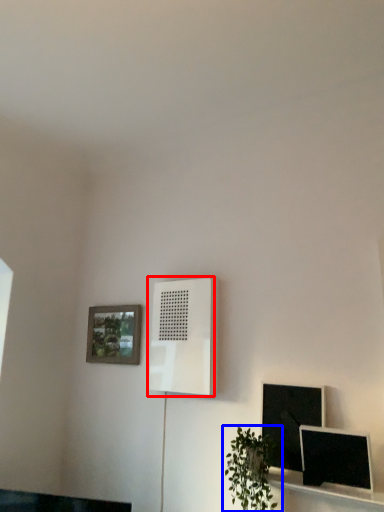
Question: Among these objects, which one is farthest to the camera, air conditioner (highlighted by a red box) or houseplant (highlighted by a blue box)?

Choices:
 (A) air conditioner
 (B) houseplant

Answer: (A)